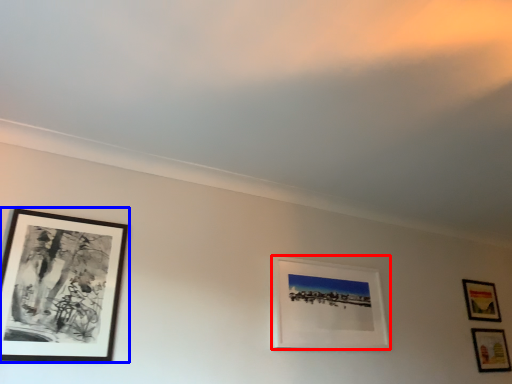
Question: Which object is closer to the camera taking this photo, picture frame (highlighted by a red box) or picture frame (highlighted by a blue box)?

Choices:
 (A) picture frame
 (B) picture frame

Answer: (B)